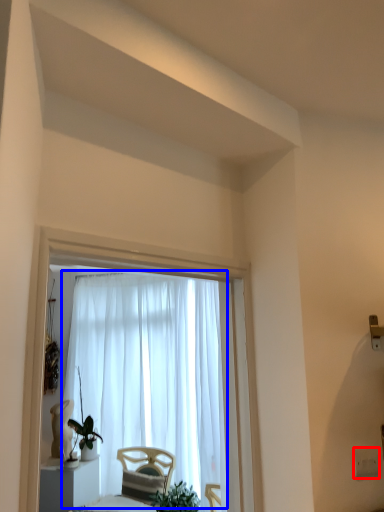
Question: Which of the following is the closest to the observer, electric outlet (highlighted by a red box) or curtain (highlighted by a blue box)?

Choices:
 (A) electric outlet
 (B) curtain

Answer: (A)